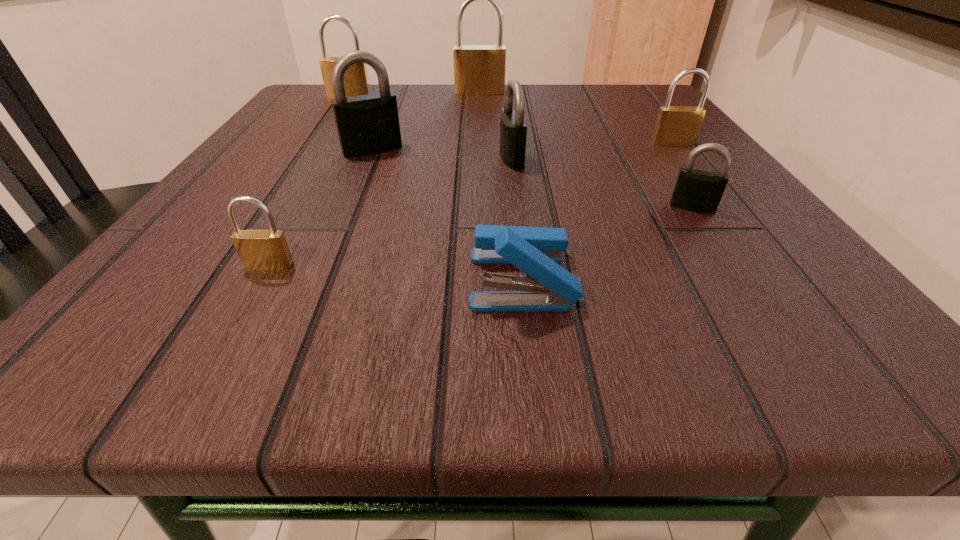
This screenshot has width=960, height=540. Find the location of `the smallest brass padlock`. the smallest brass padlock is located at coordinates (266, 250).

This screenshot has width=960, height=540. Identify the location of stapler. (546, 287).

Locate an element on the screen. free space located on the front-facing side of the second brass padlock from right to left is located at coordinates (479, 190).

Locate an element on the screen. free location located on the front-facing side of the second biggest brass padlock is located at coordinates (311, 157).

You are a GUI agent. You are given a task and a screenshot of the screen. Output one action in this format:
    pyautogui.click(x=<x>, y=<y>)
    Task: Click on the vacant space located on the front of the biggest black padlock
    
    Given the screenshot: What is the action you would take?
    pyautogui.click(x=345, y=217)

Image resolution: width=960 pixels, height=540 pixels. Find the location of `vacant space situated on the back of the second black padlock from right to left`. vacant space situated on the back of the second black padlock from right to left is located at coordinates (503, 86).

Where is `free spot located on the front-facing side of the third biggest brass padlock`? free spot located on the front-facing side of the third biggest brass padlock is located at coordinates (794, 301).

Locate an element on the screen. The height and width of the screenshot is (540, 960). blank space located 0.230m on the left of the rightmost black padlock is located at coordinates (499, 207).

This screenshot has width=960, height=540. Find the location of `free location located on the front-facing side of the nearest brass padlock`. free location located on the front-facing side of the nearest brass padlock is located at coordinates (241, 316).

Where is `free space located on the left of the stapler`? This screenshot has height=540, width=960. free space located on the left of the stapler is located at coordinates [168, 280].